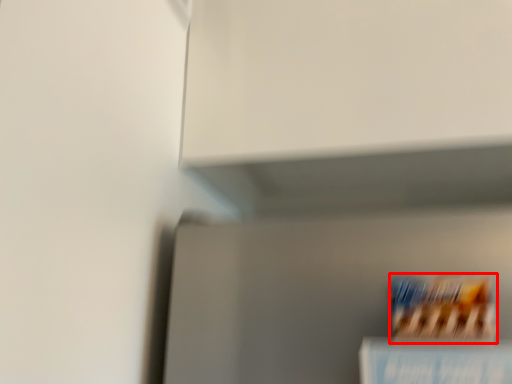
Question: From the image's perspective, where is cereal (annotated by the red box) located in relation to book in the image?

Choices:
 (A) above
 (B) below

Answer: (A)